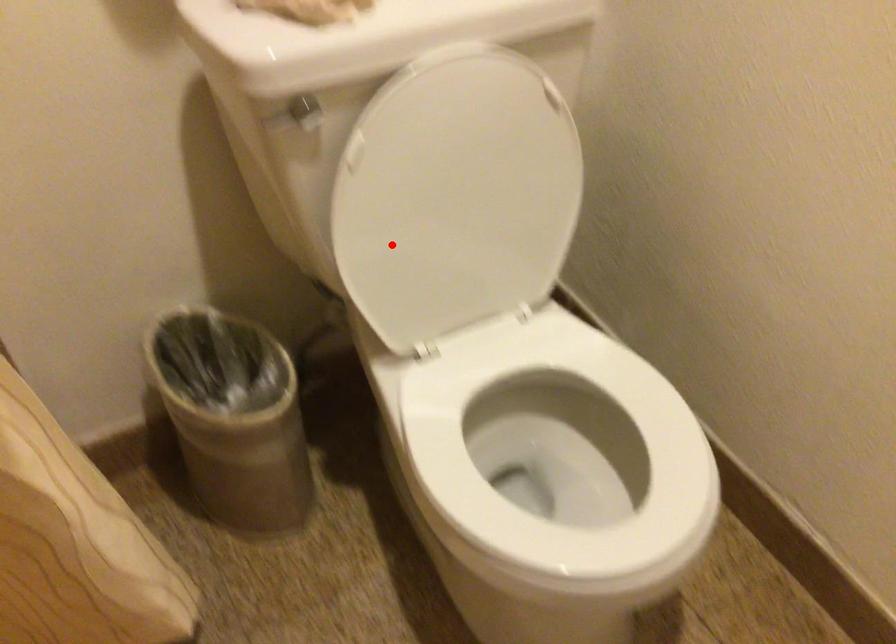
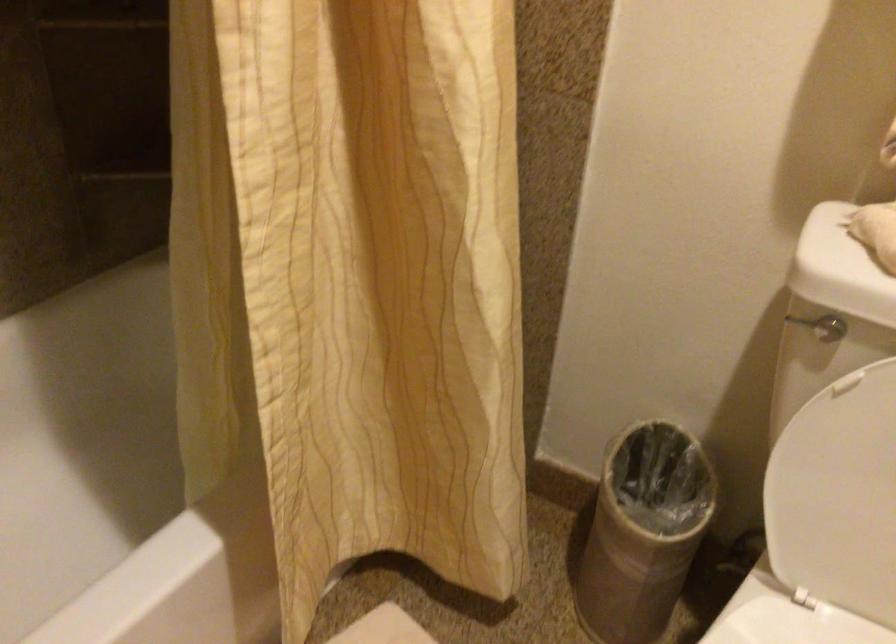
Where in the second image is the point corresponding to the highlighted location from the first image?

(834, 480)